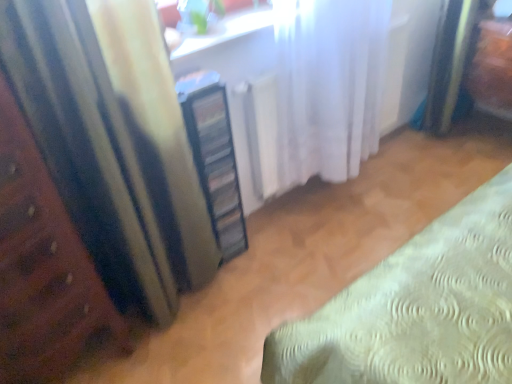
Question: Considering the relative positions of matte yellow curtain at left, the second curtain viewed from the right, and white glossy window sill at upper center in the image provided, is matte yellow curtain at left, the second curtain viewed from the right, behind white glossy window sill at upper center?

Choices:
 (A) yes
 (B) no

Answer: (B)

Question: Considering the relative sizes of matte yellow curtain at left, the 1th curtain from the left, and white glossy window sill at upper center in the image provided, is matte yellow curtain at left, the 1th curtain from the left, shorter than white glossy window sill at upper center?

Choices:
 (A) no
 (B) yes

Answer: (A)

Question: From a real-world perspective, is matte yellow curtain at left, the 1th curtain from the left, physically above white glossy window sill at upper center?

Choices:
 (A) yes
 (B) no

Answer: (B)

Question: Does matte yellow curtain at left, the second curtain viewed from the right, turn towards white glossy window sill at upper center?

Choices:
 (A) no
 (B) yes

Answer: (A)

Question: Can you confirm if matte yellow curtain at left, the 1th curtain from the left, is positioned to the left of white glossy window sill at upper center?

Choices:
 (A) no
 (B) yes

Answer: (B)

Question: From a real-world perspective, is wooden bed frame at left physically located above or below white glossy window sill at upper center?

Choices:
 (A) above
 (B) below

Answer: (B)

Question: From the image's perspective, relative to white glossy window sill at upper center, is wooden bed frame at left above or below?

Choices:
 (A) above
 (B) below

Answer: (B)

Question: Looking at their shapes, would you say wooden bed frame at left is wider or thinner than white glossy window sill at upper center?

Choices:
 (A) thin
 (B) wide

Answer: (B)

Question: Is wooden bed frame at left bigger or smaller than white glossy window sill at upper center?

Choices:
 (A) small
 (B) big

Answer: (B)

Question: In the image, is clear plastic cabinet at center positioned in front of or behind wooden bed frame at left?

Choices:
 (A) behind
 (B) front

Answer: (A)

Question: Is clear plastic cabinet at center inside or outside of wooden bed frame at left?

Choices:
 (A) outside
 (B) inside

Answer: (A)

Question: Is clear plastic cabinet at center bigger or smaller than wooden bed frame at left?

Choices:
 (A) small
 (B) big

Answer: (A)

Question: Is clear plastic cabinet at center to the left or to the right of wooden bed frame at left in the image?

Choices:
 (A) right
 (B) left

Answer: (A)

Question: Is white sheer curtain at center, the second curtain from the left, bigger or smaller than matte yellow curtain at left, the second curtain viewed from the right?

Choices:
 (A) small
 (B) big

Answer: (B)

Question: Considering the positions of white sheer curtain at center, the second curtain from the left, and matte yellow curtain at left, the 1th curtain from the left, in the image, is white sheer curtain at center, the second curtain from the left, wider or thinner than matte yellow curtain at left, the 1th curtain from the left,?

Choices:
 (A) thin
 (B) wide

Answer: (B)